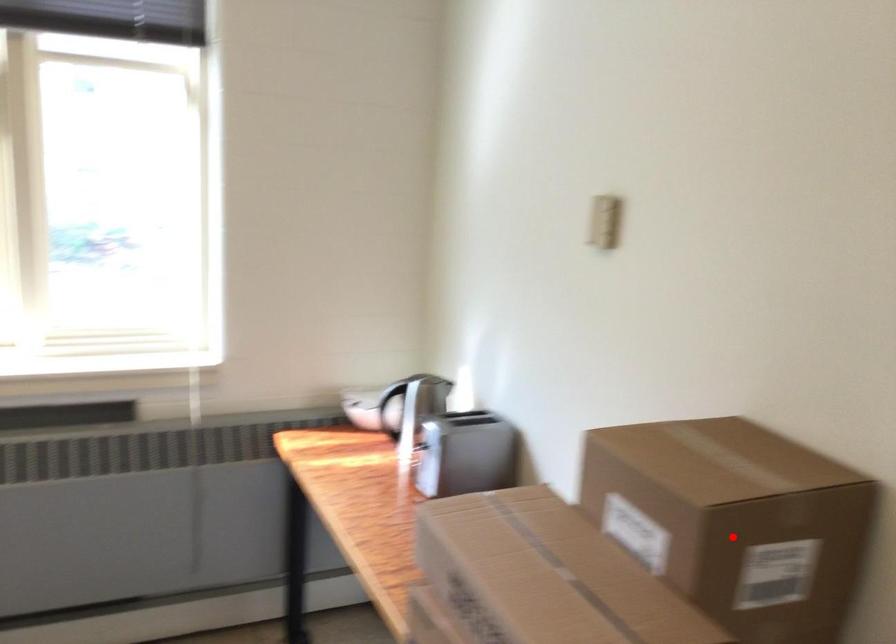
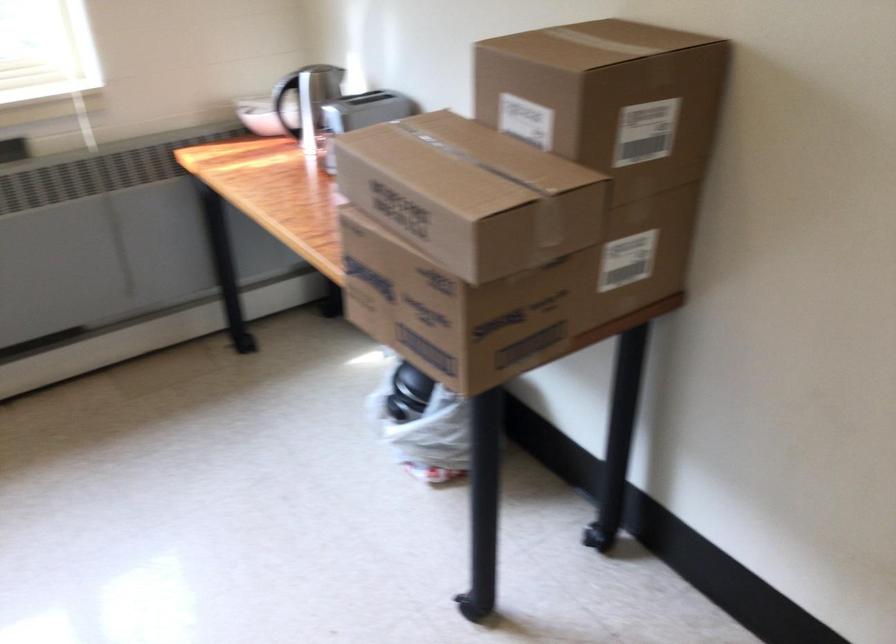
In the second image, find the point that corresponds to the highlighted location in the first image.

(607, 98)